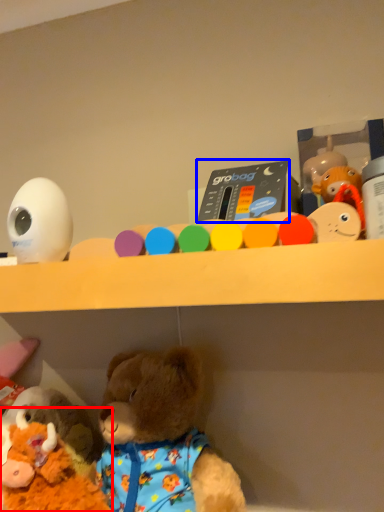
Question: Which object appears farthest to the camera in this image, toy (highlighted by a red box) or toy (highlighted by a blue box)?

Choices:
 (A) toy
 (B) toy

Answer: (B)